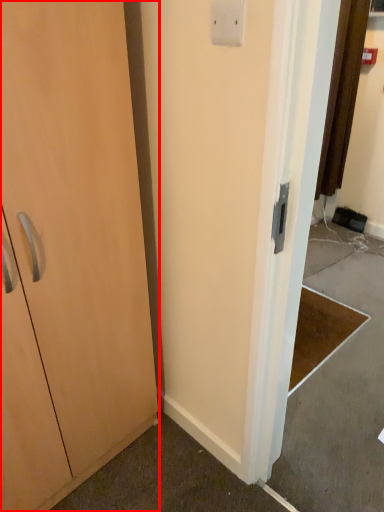
Question: Observing the image, what is the correct spatial positioning of cabinetry (annotated by the red box) in reference to light switch?

Choices:
 (A) right
 (B) left

Answer: (B)